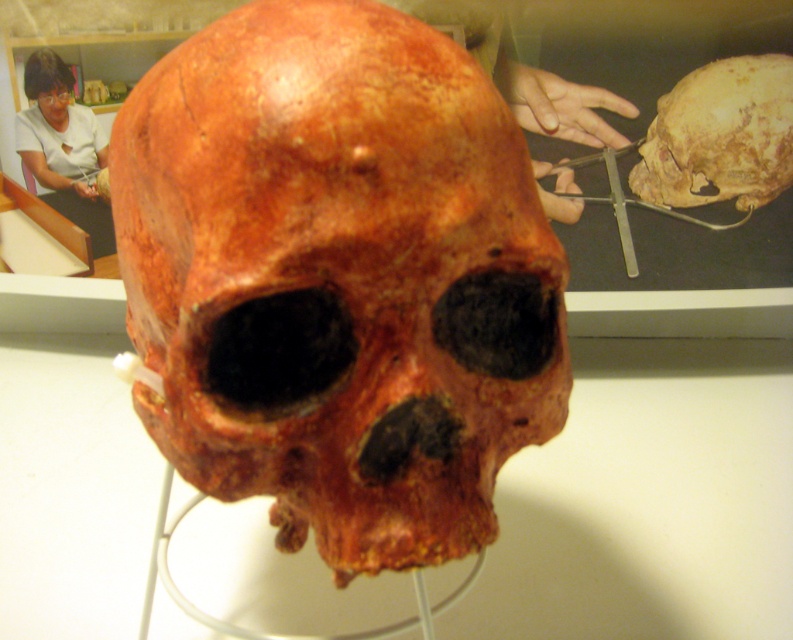
Looking at this image, you are a museum curator who needs to place both the rusty brown skull at center and the matte brown skull at center on a shelf that can only hold items up to the size of the bigger one. Which skull should you choose to fit on the shelf?

The rusty brown skull at center is bigger than the matte brown skull at center, so you should choose the matte brown skull at center to fit on the shelf since it is smaller and within the size limit.